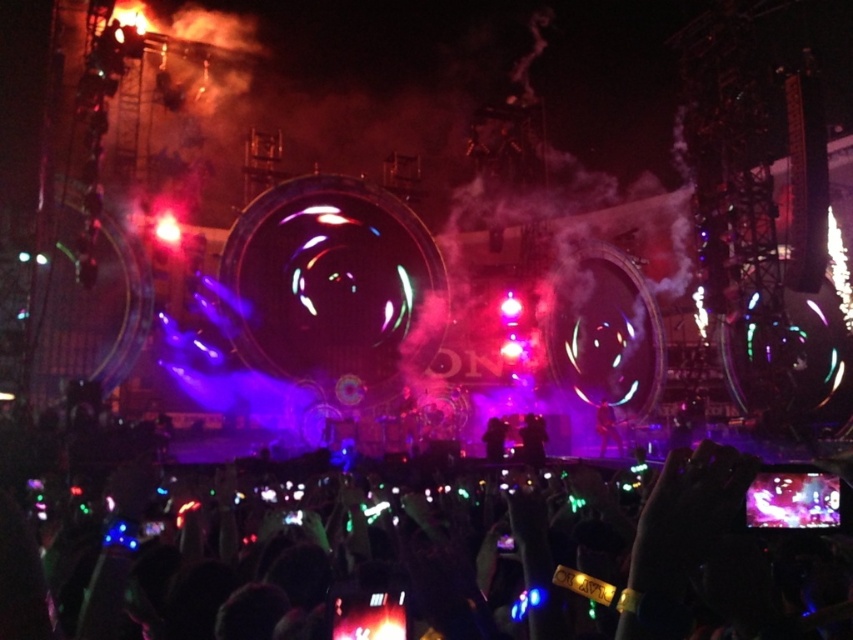
Can you confirm if silvery reflective phone at center is smaller than black matte figure at center?

No, silvery reflective phone at center is not smaller than black matte figure at center.

Who is more forward, (x=277, y=531) or (x=527, y=420)?

Point (x=277, y=531)

Who is more distant from viewer, (445, 513) or (537, 442)?

Point (537, 442)

Identify the location of silvery reflective phone at center. (431, 556).

Between silvery reflective phone at center and black velvet suit at center, which one has less height?

Standing shorter between the two is black velvet suit at center.

Is point (467, 483) positioned before point (492, 440)?

Yes.

This screenshot has height=640, width=853. Identify the location of silvery reflective phone at center. (431, 556).

At what (x,y) coordinates should I click in order to perform the action: click on silvery reflective phone at center. Please return your answer as a coordinate pair (x, y). The height and width of the screenshot is (640, 853). Looking at the image, I should click on (431, 556).

Which is more to the right, black matte figure at center or black velvet suit at center?

Positioned to the right is black matte figure at center.

Measure the distance between black matte figure at center and camera.

A distance of 83.75 meters exists between black matte figure at center and camera.

Does point (541, 460) come closer to viewer compared to point (492, 456)?

Yes.

Locate an element on the screen. This screenshot has width=853, height=640. black matte figure at center is located at coordinates (532, 440).